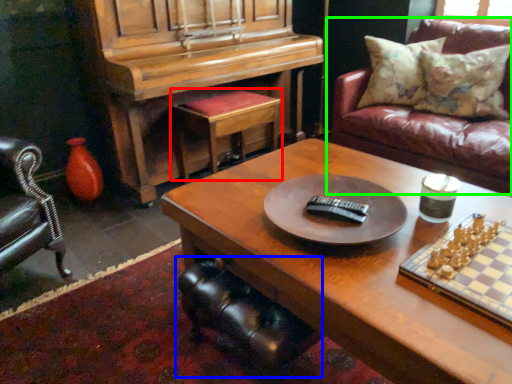
Question: Which object is positioned closest to stool (highlighted by a red box)? Select from swivel chair (highlighted by a blue box) and studio couch (highlighted by a green box).

Choices:
 (A) swivel chair
 (B) studio couch

Answer: (B)